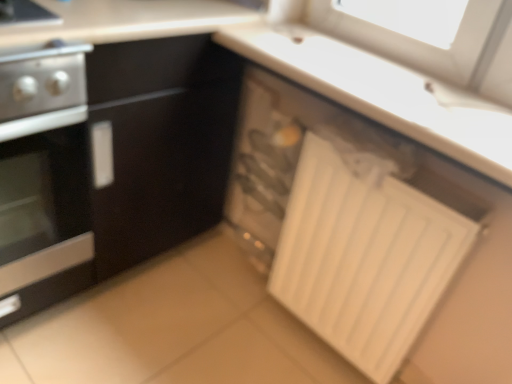
Question: Should I look upward or downward to see white plastic drawer at lower right?

Choices:
 (A) down
 (B) up

Answer: (B)

Question: Is white plastic drawer at lower right thinner than stainless steel oven at left?

Choices:
 (A) no
 (B) yes

Answer: (B)

Question: From the image's perspective, does white plastic drawer at lower right appear lower than stainless steel oven at left?

Choices:
 (A) yes
 (B) no

Answer: (A)

Question: Could you tell me if white plastic drawer at lower right is turned towards stainless steel oven at left?

Choices:
 (A) no
 (B) yes

Answer: (A)

Question: Is white plastic drawer at lower right closer to the viewer compared to stainless steel oven at left?

Choices:
 (A) yes
 (B) no

Answer: (B)

Question: From the image's perspective, is white plastic drawer at lower right over stainless steel oven at left?

Choices:
 (A) yes
 (B) no

Answer: (B)

Question: From a real-world perspective, is white plastic drawer at lower right over stainless steel oven at left?

Choices:
 (A) yes
 (B) no

Answer: (B)

Question: From the image's perspective, is white matte radiator at lower right located beneath white plastic drawer at lower right?

Choices:
 (A) no
 (B) yes

Answer: (B)

Question: Is white matte radiator at lower right completely or partially outside of white plastic drawer at lower right?

Choices:
 (A) yes
 (B) no

Answer: (A)

Question: Is white plastic drawer at lower right at the back of white matte radiator at lower right?

Choices:
 (A) yes
 (B) no

Answer: (A)

Question: From a real-world perspective, is white matte radiator at lower right below white plastic drawer at lower right?

Choices:
 (A) yes
 (B) no

Answer: (A)

Question: Is white plastic drawer at lower right located within white matte radiator at lower right?

Choices:
 (A) no
 (B) yes

Answer: (B)

Question: Is the surface of white matte radiator at lower right in direct contact with white plastic drawer at lower right?

Choices:
 (A) yes
 (B) no

Answer: (B)

Question: Is white matte radiator at lower right turned away from stainless steel oven at left?

Choices:
 (A) no
 (B) yes

Answer: (A)